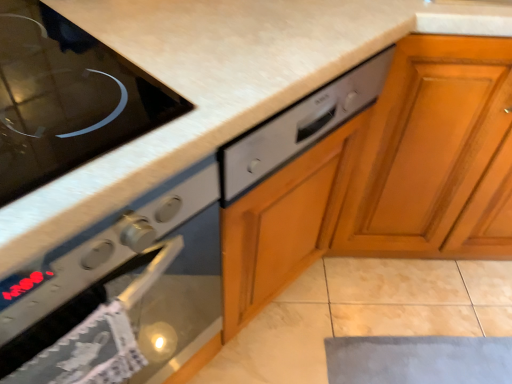
Question: From a real-world perspective, is wooden cabinet at right below satin silver oven at left?

Choices:
 (A) no
 (B) yes

Answer: (B)

Question: From the image's perspective, is wooden cabinet at right over satin silver oven at left?

Choices:
 (A) yes
 (B) no

Answer: (A)

Question: Does wooden cabinet at right appear on the right side of satin silver oven at left?

Choices:
 (A) yes
 (B) no

Answer: (A)

Question: Is wooden cabinet at right far away from satin silver oven at left?

Choices:
 (A) yes
 (B) no

Answer: (B)

Question: Can you see wooden cabinet at right touching satin silver oven at left?

Choices:
 (A) yes
 (B) no

Answer: (B)

Question: Is point (279, 124) closer or farther from the camera than point (200, 188)?

Choices:
 (A) closer
 (B) farther

Answer: (B)

Question: From a real-world perspective, is satin silver dishwasher at center above or below satin silver oven at left?

Choices:
 (A) above
 (B) below

Answer: (A)

Question: Visually, is satin silver dishwasher at center positioned to the left or to the right of satin silver oven at left?

Choices:
 (A) right
 (B) left

Answer: (A)

Question: Which is correct: satin silver dishwasher at center is inside satin silver oven at left, or outside of it?

Choices:
 (A) outside
 (B) inside

Answer: (A)

Question: From the image's perspective, is wooden cabinet at right positioned above or below satin silver dishwasher at center?

Choices:
 (A) below
 (B) above

Answer: (B)

Question: From a real-world perspective, is wooden cabinet at right physically located above or below satin silver dishwasher at center?

Choices:
 (A) below
 (B) above

Answer: (A)

Question: Looking at the image, does wooden cabinet at right seem bigger or smaller compared to satin silver dishwasher at center?

Choices:
 (A) big
 (B) small

Answer: (A)

Question: In terms of height, does wooden cabinet at right look taller or shorter compared to satin silver dishwasher at center?

Choices:
 (A) short
 (B) tall

Answer: (B)

Question: Relative to satin silver dishwasher at center, is black glass cooktop at upper left in front or behind?

Choices:
 (A) behind
 (B) front

Answer: (B)

Question: Is black glass cooktop at upper left to the left or to the right of satin silver dishwasher at center in the image?

Choices:
 (A) right
 (B) left

Answer: (B)